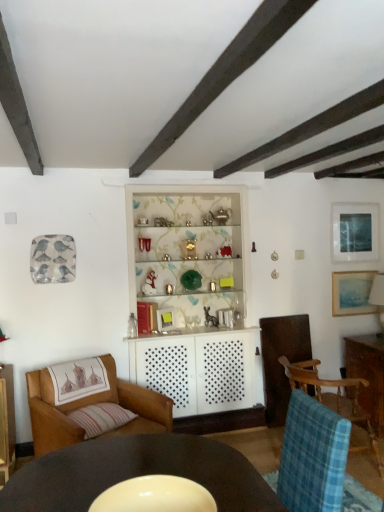
At what (x,y) coordinates should I click in order to perform the action: click on smooth dark wood table at lower center. Please return your answer as a coordinate pair (x, y). Looking at the image, I should click on (137, 473).

Image resolution: width=384 pixels, height=512 pixels. What do you see at coordinates (89, 405) in the screenshot?
I see `brown leather chair at lower left, placed as the second chair when sorted from right to left` at bounding box center [89, 405].

This screenshot has width=384, height=512. What do you see at coordinates (352, 293) in the screenshot? I see `matte blue painting at upper right, arranged as the 1th picture frame when ordered from the bottom` at bounding box center [352, 293].

Identify the location of smooth dark wood table at lower center. The width and height of the screenshot is (384, 512). (137, 473).

Is matte blue painting at upper right, the first picture frame viewed from the top, positioned far away from matte blue painting at upper right, arranged as the 1th picture frame when ordered from the bottom?

No.

Considering the relative sizes of matte blue painting at upper right, the first picture frame viewed from the top, and matte blue painting at upper right, arranged as the 1th picture frame when ordered from the bottom, in the image provided, is matte blue painting at upper right, the first picture frame viewed from the top, thinner than matte blue painting at upper right, arranged as the 1th picture frame when ordered from the bottom,?

Correct, the width of matte blue painting at upper right, the first picture frame viewed from the top, is less than that of matte blue painting at upper right, arranged as the 1th picture frame when ordered from the bottom.

Is matte blue painting at upper right, the second picture frame positioned from the bottom, bigger or smaller than matte blue painting at upper right, which is the second picture frame from top to bottom?

Considering their sizes, matte blue painting at upper right, the second picture frame positioned from the bottom, takes up more space than matte blue painting at upper right, which is the second picture frame from top to bottom.

Between matte blue painting at upper right, the second picture frame positioned from the bottom, and matte blue painting at upper right, which is the second picture frame from top to bottom, which one is positioned behind?

matte blue painting at upper right, which is the second picture frame from top to bottom, is behind.

How many degrees apart are the facing directions of brown leather chair at lower left, placed as the second chair when sorted from right to left, and matte blue painting at upper right, arranged as the 1th picture frame when ordered from the bottom?

23.7 degrees separate the facing orientations of brown leather chair at lower left, placed as the second chair when sorted from right to left, and matte blue painting at upper right, arranged as the 1th picture frame when ordered from the bottom.

Is brown leather chair at lower left, the first chair positioned from the left, taller or shorter than matte blue painting at upper right, which is the second picture frame from top to bottom?

Clearly, brown leather chair at lower left, the first chair positioned from the left, is taller compared to matte blue painting at upper right, which is the second picture frame from top to bottom.

From the image's perspective, which is above, brown leather chair at lower left, placed as the second chair when sorted from right to left, or matte blue painting at upper right, arranged as the 1th picture frame when ordered from the bottom?

matte blue painting at upper right, arranged as the 1th picture frame when ordered from the bottom, appears higher in the image.

Does point (126, 381) appear closer or farther from the camera than point (362, 306)?

Point (126, 381) is positioned closer to the camera compared to point (362, 306).

Between smooth dark wood table at lower center and brown leather chair at lower left, placed as the second chair when sorted from right to left, which one has smaller size?

smooth dark wood table at lower center.

Would you say brown leather chair at lower left, the first chair positioned from the left, is part of smooth dark wood table at lower center's contents?

Actually, brown leather chair at lower left, the first chair positioned from the left, is outside smooth dark wood table at lower center.

Is the surface of smooth dark wood table at lower center in direct contact with brown leather chair at lower left, the first chair positioned from the left?

smooth dark wood table at lower center is not next to brown leather chair at lower left, the first chair positioned from the left, and they're not touching.

From the image's perspective, is smooth dark wood table at lower center above or below brown leather chair at lower left, the first chair positioned from the left?

Based on their image positions, smooth dark wood table at lower center is located above brown leather chair at lower left, the first chair positioned from the left.

Can you tell me how much blue plaid fabric chair at lower right, which is the 2th chair from left to right, and white textured cabinet at center differ in facing direction?

blue plaid fabric chair at lower right, which is the 2th chair from left to right, and white textured cabinet at center are facing 89.8 degrees away from each other.

Does blue plaid fabric chair at lower right, the first chair in the right-to-left sequence, appear on the left side of white textured cabinet at center?

Incorrect, blue plaid fabric chair at lower right, the first chair in the right-to-left sequence, is not on the left side of white textured cabinet at center.

From a real-world perspective, who is located lower, blue plaid fabric chair at lower right, which is the 2th chair from left to right, or white textured cabinet at center?

blue plaid fabric chair at lower right, which is the 2th chair from left to right.

Is blue plaid fabric chair at lower right, the first chair in the right-to-left sequence, thinner than white textured cabinet at center?

Incorrect, the width of blue plaid fabric chair at lower right, the first chair in the right-to-left sequence, is not less than that of white textured cabinet at center.

Considering the sizes of objects striped fabric pillow at lower left and brown leather chair at lower left, the first chair positioned from the left, in the image provided, who is thinner, striped fabric pillow at lower left or brown leather chair at lower left, the first chair positioned from the left,?

With smaller width is striped fabric pillow at lower left.

Can you tell me how much striped fabric pillow at lower left and brown leather chair at lower left, placed as the second chair when sorted from right to left, differ in facing direction?

They differ by 7.54e-05 degrees in their facing directions.

Is point (80, 424) more distant than point (41, 446)?

No, (80, 424) is closer to viewer.

Is striped fabric pillow at lower left not inside brown leather chair at lower left, placed as the second chair when sorted from right to left?

No, most part of striped fabric pillow at lower left lies within brown leather chair at lower left, placed as the second chair when sorted from right to left.

Is white textured cabinet at center next to brown leather chair at lower left, placed as the second chair when sorted from right to left?

No, white textured cabinet at center is not beside brown leather chair at lower left, placed as the second chair when sorted from right to left.

From the image's perspective, is white textured cabinet at center on brown leather chair at lower left, the first chair positioned from the left?

Yes.

Considering the relative sizes of white textured cabinet at center and brown leather chair at lower left, the first chair positioned from the left, in the image provided, is white textured cabinet at center shorter than brown leather chair at lower left, the first chair positioned from the left,?

No, white textured cabinet at center is not shorter than brown leather chair at lower left, the first chair positioned from the left.

Does white textured cabinet at center have a smaller size compared to brown leather chair at lower left, placed as the second chair when sorted from right to left?

Actually, white textured cabinet at center might be larger than brown leather chair at lower left, placed as the second chair when sorted from right to left.

Which is in front, matte blue painting at upper right, the first picture frame viewed from the top, or blue plaid fabric chair at lower right, the first chair in the right-to-left sequence?

Positioned in front is blue plaid fabric chair at lower right, the first chair in the right-to-left sequence.

Does point (362, 236) appear closer or farther from the camera than point (348, 402)?

Point (362, 236) is farther from the camera than point (348, 402).

Which of these two, matte blue painting at upper right, the first picture frame viewed from the top, or blue plaid fabric chair at lower right, which is the 2th chair from left to right, is smaller?

matte blue painting at upper right, the first picture frame viewed from the top, is smaller.

In order to click on picture frame that appears behind the matte blue painting at upper right, the first picture frame viewed from the top in this screenshot , I will do `click(352, 293)`.

The height and width of the screenshot is (512, 384). Identify the location of picture frame that is the 1st one when counting upward from the brown leather chair at lower left, the first chair positioned from the left (from the image's perspective). (352, 293).

Which object lies further to the anchor point striped fabric pillow at lower left, smooth dark wood table at lower center or blue plaid fabric chair at lower right, which is the 2th chair from left to right?

The object further to striped fabric pillow at lower left is blue plaid fabric chair at lower right, which is the 2th chair from left to right.

Which object lies further to the anchor point matte blue painting at upper right, the first picture frame viewed from the top, blue plaid fabric chair at lower right, which is the 2th chair from left to right, or matte blue painting at upper right, arranged as the 1th picture frame when ordered from the bottom?

blue plaid fabric chair at lower right, which is the 2th chair from left to right.

Looking at the image, which one is located further to matte blue painting at upper right, arranged as the 1th picture frame when ordered from the bottom, smooth dark wood table at lower center or white textured cabinet at center?

smooth dark wood table at lower center is further to matte blue painting at upper right, arranged as the 1th picture frame when ordered from the bottom.

Which object lies further to the anchor point smooth dark wood table at lower center, white textured cabinet at center or matte blue painting at upper right, arranged as the 1th picture frame when ordered from the bottom?

Among the two, matte blue painting at upper right, arranged as the 1th picture frame when ordered from the bottom, is located further to smooth dark wood table at lower center.

Estimate the real-world distances between objects in this image. Which object is closer to matte blue painting at upper right, which is the second picture frame from top to bottom, brown leather chair at lower left, placed as the second chair when sorted from right to left, or blue plaid fabric chair at lower right, which is the 2th chair from left to right?

Based on the image, blue plaid fabric chair at lower right, which is the 2th chair from left to right, appears to be nearer to matte blue painting at upper right, which is the second picture frame from top to bottom.

Based on their spatial positions, is striped fabric pillow at lower left or matte blue painting at upper right, the second picture frame positioned from the bottom, closer to smooth dark wood table at lower center?

striped fabric pillow at lower left is positioned closer to the anchor smooth dark wood table at lower center.

From the image, which object appears to be nearer to striped fabric pillow at lower left, matte blue painting at upper right, the first picture frame viewed from the top, or white textured cabinet at center?

The object closer to striped fabric pillow at lower left is white textured cabinet at center.

Which object lies further to the anchor point striped fabric pillow at lower left, matte blue painting at upper right, arranged as the 1th picture frame when ordered from the bottom, or brown leather chair at lower left, the first chair positioned from the left?

Based on the image, matte blue painting at upper right, arranged as the 1th picture frame when ordered from the bottom, appears to be further to striped fabric pillow at lower left.

I want to click on pillow between smooth dark wood table at lower center and white textured cabinet at center from front to back, so click(x=101, y=418).

I want to click on dresser situated between striped fabric pillow at lower left and matte blue painting at upper right, the second picture frame positioned from the bottom, from left to right, so click(192, 297).

Find the location of a particular element. pillow located between smooth dark wood table at lower center and matte blue painting at upper right, the first picture frame viewed from the top, in the depth direction is located at coordinates (101, 418).

In order to click on chair between brown leather chair at lower left, placed as the second chair when sorted from right to left, and matte blue painting at upper right, arranged as the 1th picture frame when ordered from the bottom in this screenshot , I will do `click(334, 397)`.